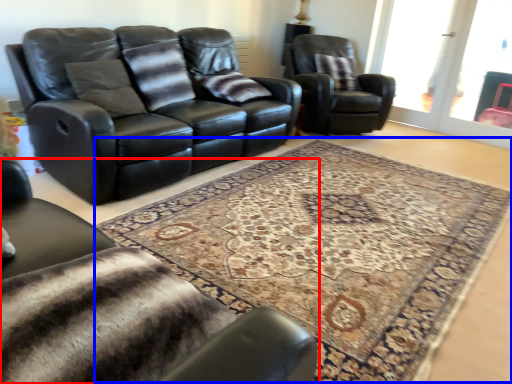
Question: Which point is closer to the camera, chair (highlighted by a red box) or mat (highlighted by a blue box)?

Choices:
 (A) chair
 (B) mat

Answer: (A)